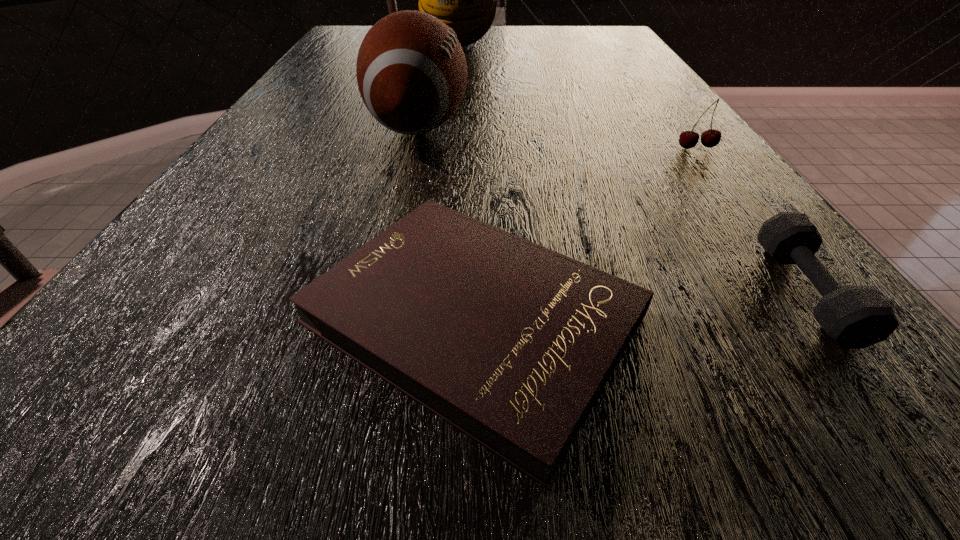
Identify the location of object that is at the far edge. The width and height of the screenshot is (960, 540). point(465,0).

At what (x,y) coordinates should I click in order to perform the action: click on object at the near edge. Please return your answer as a coordinate pair (x, y). The width and height of the screenshot is (960, 540). Looking at the image, I should click on tap(510, 342).

In order to click on cherry present at the right edge in this screenshot , I will do pos(688,139).

At what (x,y) coordinates should I click in order to perform the action: click on dumbbell at the right edge. Please return your answer as a coordinate pair (x, y). Image resolution: width=960 pixels, height=540 pixels. Looking at the image, I should click on (855, 317).

Identify the location of vacant space at the far edge. (515, 46).

The image size is (960, 540). Identify the location of vacant space at the left edge of the desktop. (337, 58).

In the image, there is a desktop. Where is `blank space at the right edge`? blank space at the right edge is located at coordinates (683, 118).

The width and height of the screenshot is (960, 540). I want to click on vacant region at the far left corner of the desktop, so click(345, 26).

You are a GUI agent. You are given a task and a screenshot of the screen. Output one action in this format:
    pyautogui.click(x=<x>, y=<y>)
    Task: Click on the blank area at the far right corner
    Image resolution: width=960 pixels, height=540 pixels.
    Given the screenshot: What is the action you would take?
    pyautogui.click(x=615, y=34)

Identify the location of free spot between the cherry and the second shortest object. (752, 220).